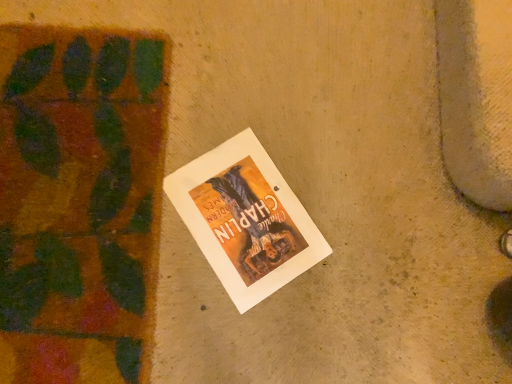
Describe the element at coordinates (80, 202) in the screenshot. The height and width of the screenshot is (384, 512). I see `green leafy plant at left` at that location.

Image resolution: width=512 pixels, height=384 pixels. Identify the location of green leafy plant at left. (80, 202).

Where is `white paper poster at center`? white paper poster at center is located at coordinates (245, 219).

Describe the element at coordinates (245, 219) in the screenshot. The height and width of the screenshot is (384, 512). I see `white paper poster at center` at that location.

Measure the distance between white paper poster at center and camera.

30.73 inches.

Find the location of a particular element. green leafy plant at left is located at coordinates (80, 202).

Which is more to the right, green leafy plant at left or white paper poster at center?

white paper poster at center.

Relative to white paper poster at center, is green leafy plant at left in front or behind?

green leafy plant at left is positioned closer to the viewer than white paper poster at center.

Considering the positions of points (88, 138) and (197, 190), is point (88, 138) closer to camera compared to point (197, 190)?

Yes, it is in front of point (197, 190).

From the image's perspective, is green leafy plant at left beneath white paper poster at center?

Incorrect, from the image's perspective, green leafy plant at left is higher than white paper poster at center.

From a real-world perspective, is green leafy plant at left positioned above or below white paper poster at center?

green leafy plant at left is situated higher than white paper poster at center in the real world.

Considering the sizes of objects green leafy plant at left and white paper poster at center in the image provided, who is thinner, green leafy plant at left or white paper poster at center?

white paper poster at center is thinner.

From the picture: Between green leafy plant at left and white paper poster at center, which one has more height?

Standing taller between the two is white paper poster at center.

Considering the sizes of green leafy plant at left and white paper poster at center in the image, is green leafy plant at left bigger or smaller than white paper poster at center?

green leafy plant at left is bigger than white paper poster at center.

Is green leafy plant at left spatially inside white paper poster at center, or outside of it?

green leafy plant at left cannot be found inside white paper poster at center.

Is green leafy plant at left far away from white paper poster at center?

No, there isn't a large distance between green leafy plant at left and white paper poster at center.

Is green leafy plant at left turned away from white paper poster at center?

No, green leafy plant at left is not facing the opposite direction of white paper poster at center.

Find the location of `book behind the green leafy plant at left`. book behind the green leafy plant at left is located at coordinates (245, 219).

Between white paper poster at center and green leafy plant at left, which one appears on the left side from the viewer's perspective?

From the viewer's perspective, green leafy plant at left appears more on the left side.

Does white paper poster at center come in front of green leafy plant at left?

No, it is not.

Does point (238, 225) lie behind point (8, 190)?

That is True.

In the scene shown: From the image's perspective, is white paper poster at center below green leafy plant at left?

Yes, from the image's perspective, white paper poster at center is beneath green leafy plant at left.

From a real-world perspective, which object stands above the other?

From a 3D spatial view, green leafy plant at left is above.

Looking at their sizes, would you say white paper poster at center is wider or thinner than green leafy plant at left?

Considering their sizes, white paper poster at center looks slimmer than green leafy plant at left.

Who is shorter, white paper poster at center or green leafy plant at left?

green leafy plant at left.

Is white paper poster at center bigger than green leafy plant at left?

No.

Is green leafy plant at left a part of white paper poster at center?

Actually, green leafy plant at left is outside white paper poster at center.

Is there a large distance between white paper poster at center and green leafy plant at left?

That's not correct — white paper poster at center is a little close to green leafy plant at left.

Is white paper poster at center looking in the opposite direction of green leafy plant at left?

white paper poster at center is not turned away from green leafy plant at left.

How many degrees apart are the facing directions of white paper poster at center and green leafy plant at left?

35.4 degrees.

Identify the location of book below the green leafy plant at left (from the image's perspective). This screenshot has width=512, height=384. [245, 219].

The image size is (512, 384). I want to click on book lying behind the green leafy plant at left, so (245, 219).

This screenshot has width=512, height=384. I want to click on plant in front of the white paper poster at center, so click(80, 202).